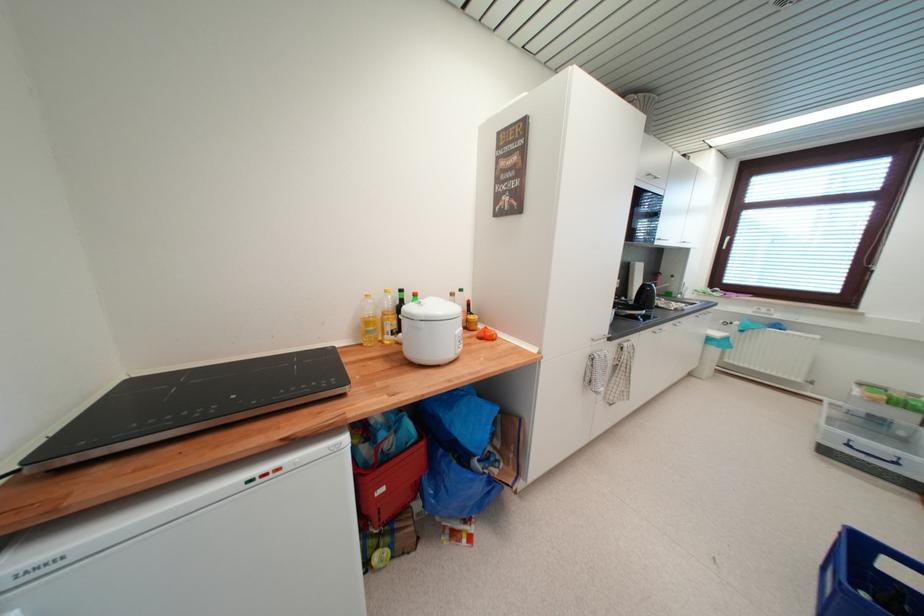
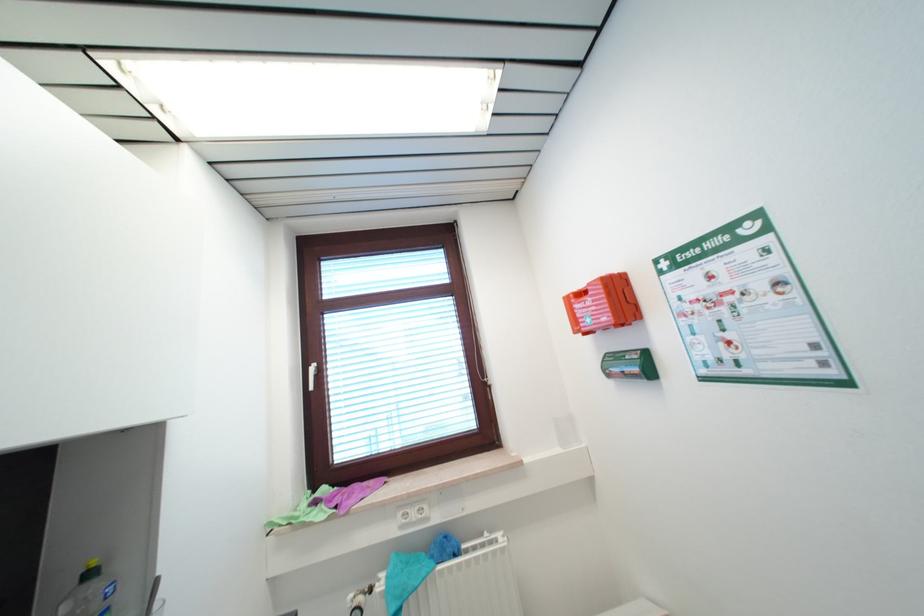
Locate, in the second image, the point that corresponds to (743,325) in the first image.

(385, 589)